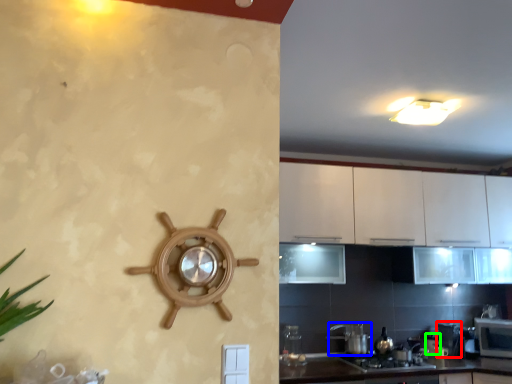
Question: Which is farther away from appliance (highlighted by a red box)? appliance (highlighted by a blue box) or appliance (highlighted by a green box)?

Choices:
 (A) appliance
 (B) appliance

Answer: (A)